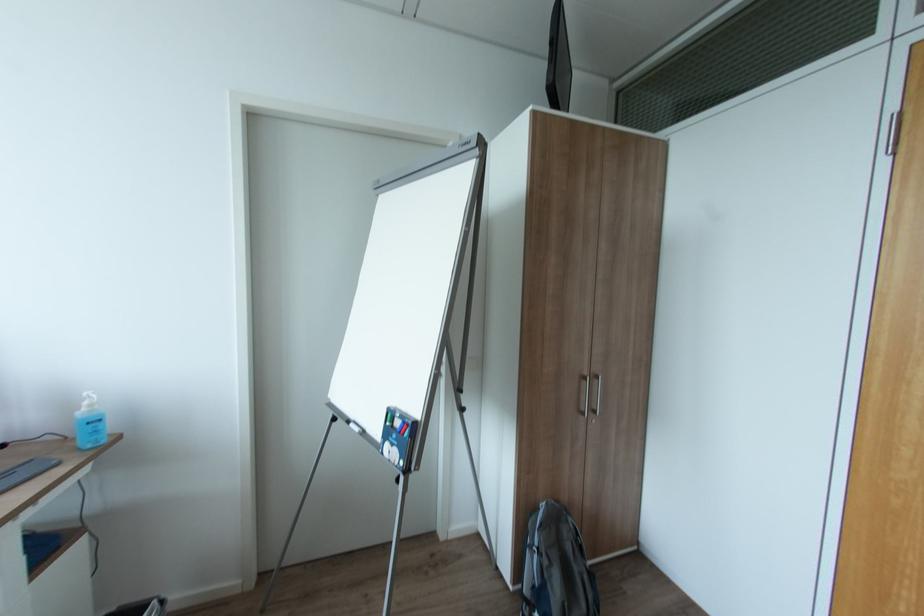
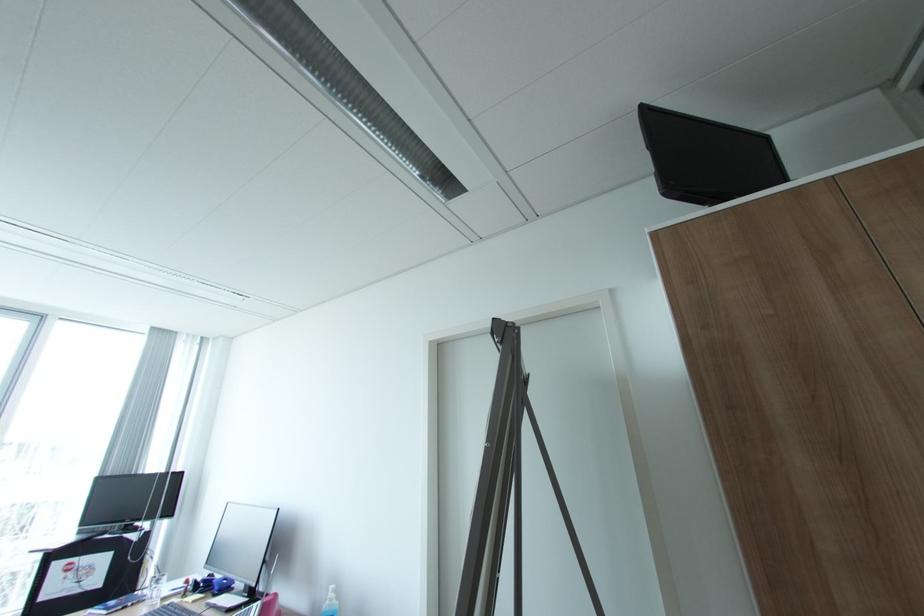
First-person continuous shooting, in which direction is the camera rotating?

The camera's rotation is toward left-up.